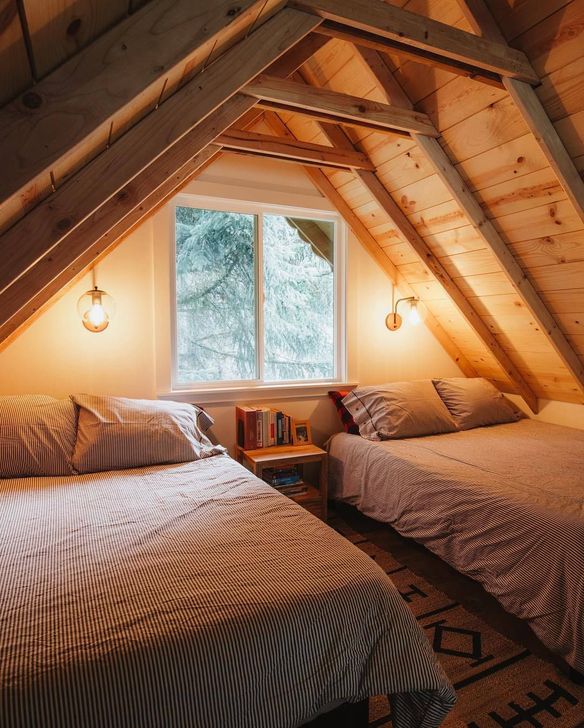
This screenshot has height=728, width=584. Find the location of `window`. window is located at coordinates [x=219, y=293], [x=301, y=309].